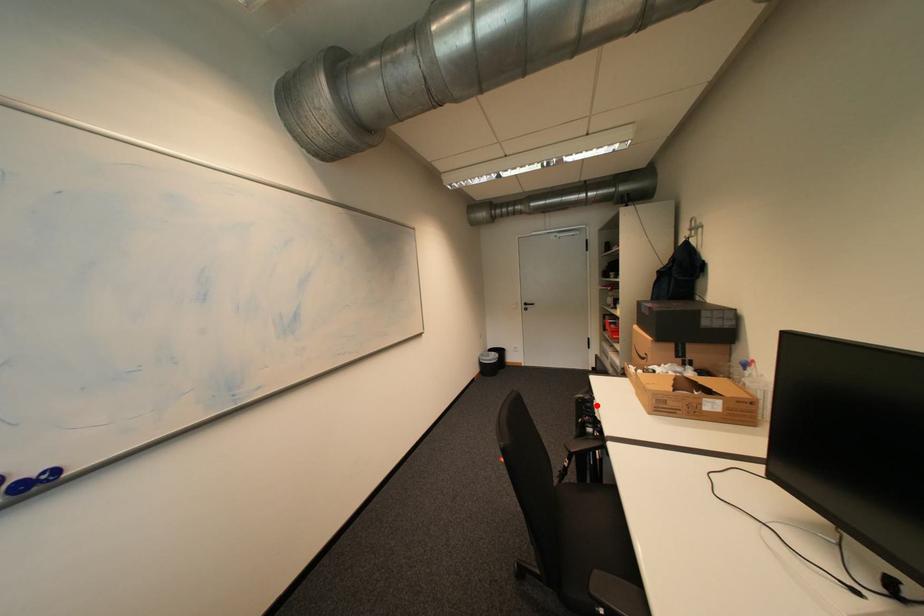
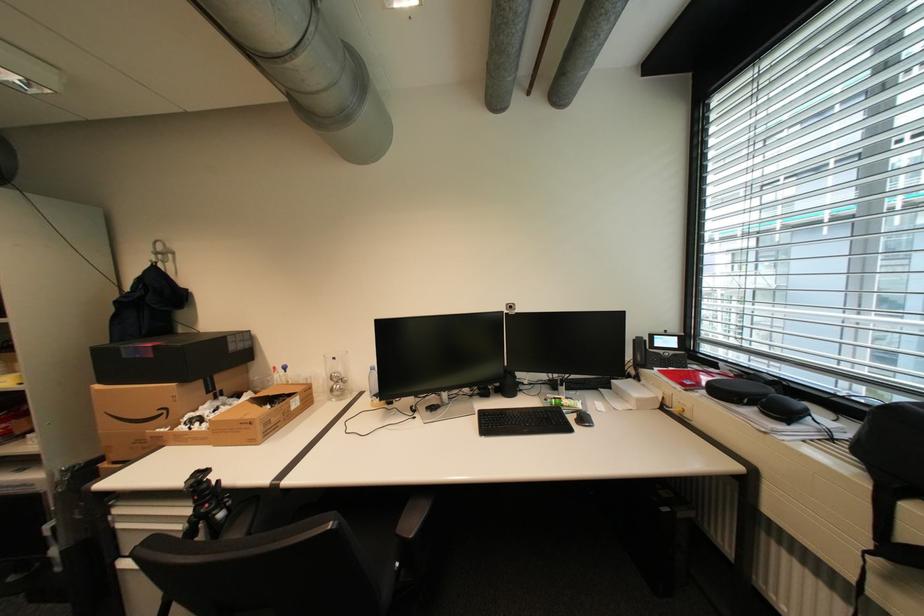
The point at the highlighted location is marked in the first image. Where is the corresponding point in the second image?

(213, 485)